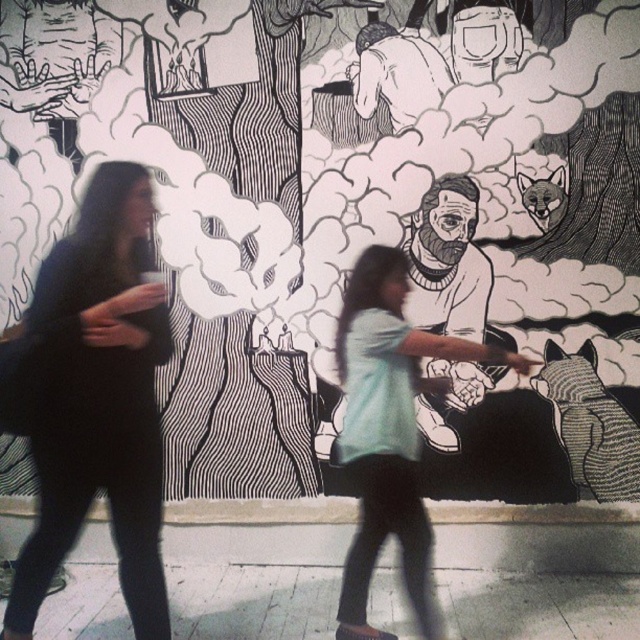
Question: Can you confirm if black matte dress at left is positioned below light blue shirt at center?

Choices:
 (A) yes
 (B) no

Answer: (B)

Question: Among these points, which one is nearest to the camera?

Choices:
 (A) (36, 518)
 (B) (356, 584)

Answer: (B)

Question: Does black matte dress at left have a smaller size compared to light blue shirt at center?

Choices:
 (A) no
 (B) yes

Answer: (B)

Question: Which object is closer to the camera taking this photo?

Choices:
 (A) light blue shirt at center
 (B) black matte dress at left

Answer: (B)

Question: Which point is farther to the camera?

Choices:
 (A) (388, 465)
 (B) (161, 602)

Answer: (A)

Question: Is black matte dress at left above light blue shirt at center?

Choices:
 (A) yes
 (B) no

Answer: (A)